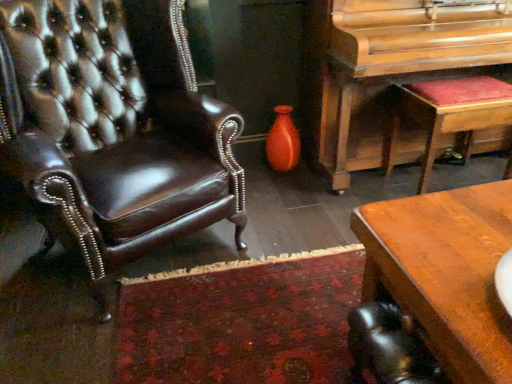
Identify the location of vacant space to the right of brown leather chair at left. The width and height of the screenshot is (512, 384). (293, 276).